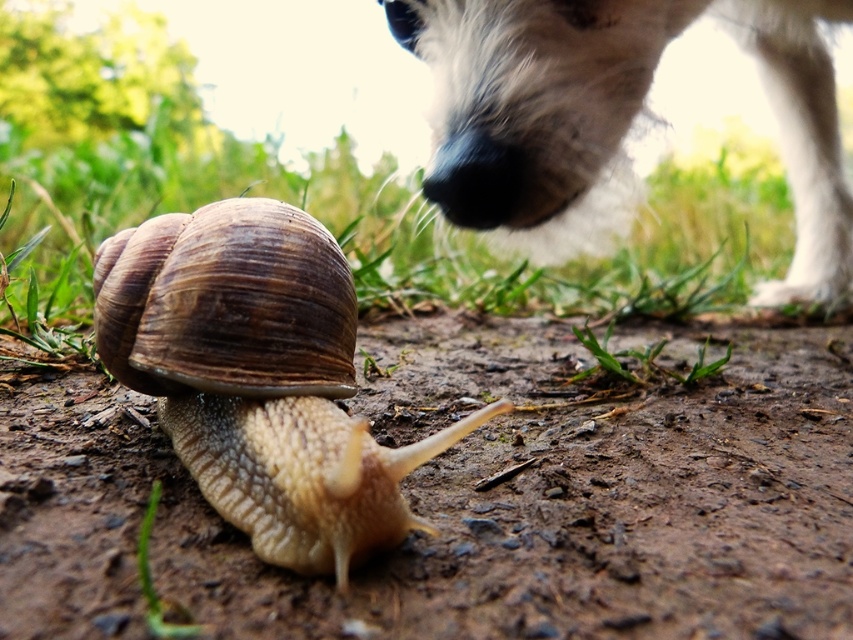
Can you confirm if green grass at lower left is bigger than white fluffy dog at upper right?

Yes.

Is point (410, 237) positioned in front of point (463, 224)?

No, it is behind (463, 224).

Identify the location of green grass at lower left. click(x=393, y=227).

Which is above, brown textured shell at center or green grass at lower left?

Positioned higher is green grass at lower left.

Can you confirm if brown textured shell at center is smaller than green grass at lower left?

Yes, brown textured shell at center is smaller than green grass at lower left.

What do you see at coordinates (258, 376) in the screenshot?
I see `brown textured shell at center` at bounding box center [258, 376].

Identify the location of brown textured shell at center. (258, 376).

Who is higher up, brown textured shell at center or white fluffy dog at upper right?

white fluffy dog at upper right is above.

Is point (293, 371) farther from camera compared to point (498, 61)?

No, (293, 371) is closer to viewer.

Identify the location of brown textured shell at center. The height and width of the screenshot is (640, 853). (258, 376).